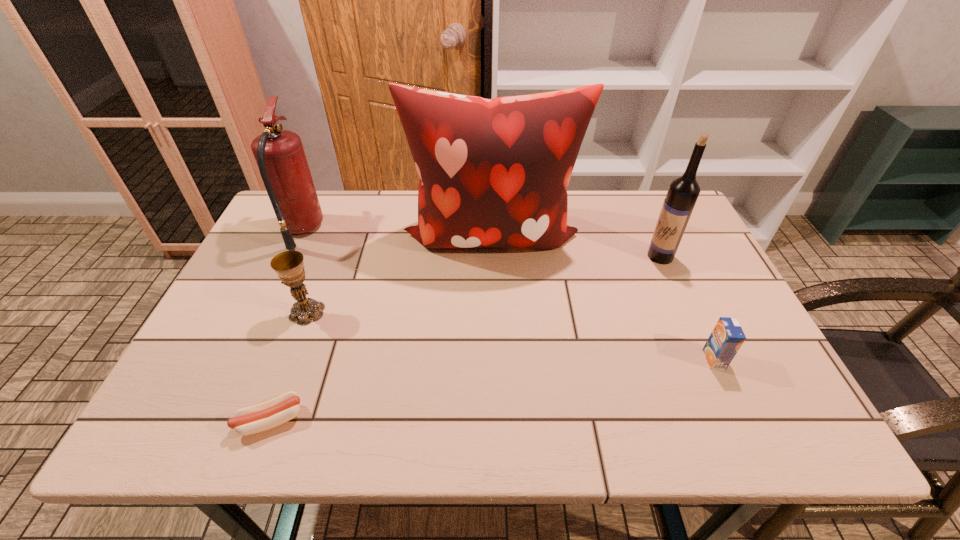
This screenshot has width=960, height=540. Find the location of `vacant area between the fifth tallest object and the chalice`. vacant area between the fifth tallest object and the chalice is located at coordinates (511, 336).

In order to click on unoccupied position between the shortest object and the fifth farthest object in this screenshot , I will do `click(492, 390)`.

Point out which object is positioned as the fourth nearest to the fifth tallest object. Please provide its 2D coordinates. Your answer should be formatted as a tuple, i.e. [(x, y)], where the tuple contains the x and y coordinates of a point satisfying the conditions above.

[(289, 266)]

Identify which object is the fifth nearest to the wine bottle. Please provide its 2D coordinates. Your answer should be formatted as a tuple, i.e. [(x, y)], where the tuple contains the x and y coordinates of a point satisfying the conditions above.

[(282, 163)]

The width and height of the screenshot is (960, 540). Find the location of `free location that satisfies the following two spatial constraints: 1. on the label of the wine bottle; 2. on the back side of the second shortest object`. free location that satisfies the following two spatial constraints: 1. on the label of the wine bottle; 2. on the back side of the second shortest object is located at coordinates (706, 359).

This screenshot has height=540, width=960. Find the location of `free space that satisfies the following two spatial constraints: 1. on the front side of the fourth tallest object; 2. on the left side of the shortest object`. free space that satisfies the following two spatial constraints: 1. on the front side of the fourth tallest object; 2. on the left side of the shortest object is located at coordinates (267, 420).

Find the location of a particular element. Image resolution: width=960 pixels, height=540 pixels. vacant space that satisfies the following two spatial constraints: 1. at the front of the fire extinguisher where the nozzle is aimed; 2. on the left side of the fifth farthest object is located at coordinates (241, 359).

Find the location of a particular element. The image size is (960, 540). vacant region that satisfies the following two spatial constraints: 1. on the back side of the nearest object; 2. on the right side of the orange_juice is located at coordinates (294, 359).

The height and width of the screenshot is (540, 960). I want to click on free point that satisfies the following two spatial constraints: 1. on the back side of the shortest object; 2. at the front of the fire extinguisher where the nozzle is aimed, so click(341, 230).

At what (x,y) coordinates should I click in order to perform the action: click on blank area in the image that satisfies the following two spatial constraints: 1. at the front of the fourth farthest object where the nozzle is aimed; 2. on the right side of the fire extinguisher. Please return your answer as a coordinate pair (x, y). Looking at the image, I should click on (263, 312).